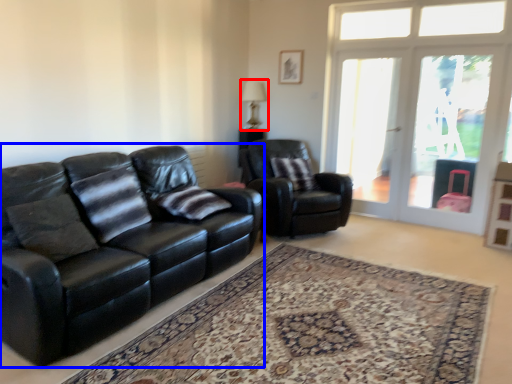
Question: Which point is closer to the camera, lamp (highlighted by a red box) or studio couch (highlighted by a blue box)?

Choices:
 (A) lamp
 (B) studio couch

Answer: (B)